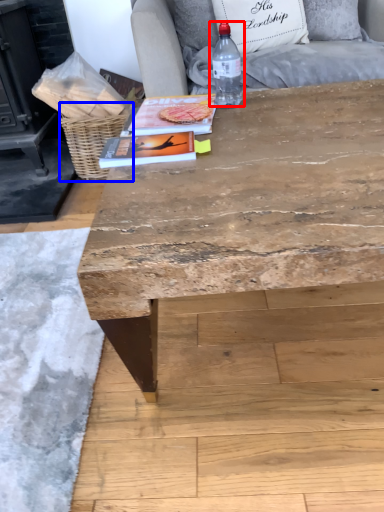
Question: Which point is further to the camera, bottle (highlighted by a red box) or basket (highlighted by a blue box)?

Choices:
 (A) bottle
 (B) basket

Answer: (B)